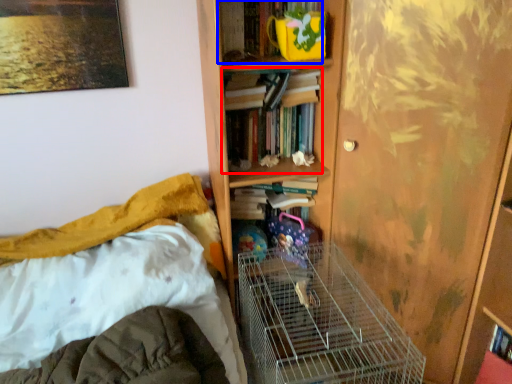
Question: Among these objects, which one is nearest to the camera, book (highlighted by a red box) or book (highlighted by a blue box)?

Choices:
 (A) book
 (B) book

Answer: (B)